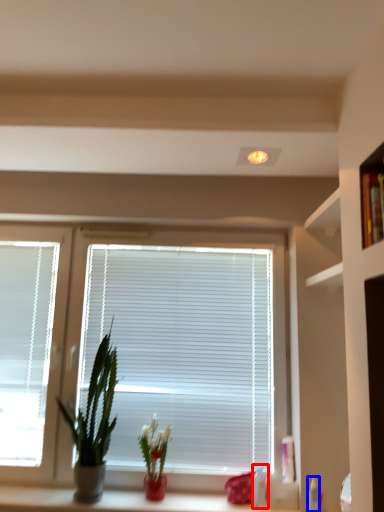
Question: Which of the following is the farthest to the observer, toiletry (highlighted by a red box) or toiletry (highlighted by a blue box)?

Choices:
 (A) toiletry
 (B) toiletry

Answer: (A)